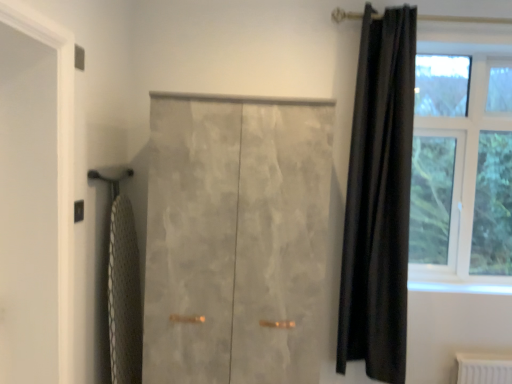
Question: Is clear glass window at upper right behind white mesh bath towel at left?

Choices:
 (A) yes
 (B) no

Answer: (A)

Question: Could you tell me if clear glass window at upper right is turned towards white mesh bath towel at left?

Choices:
 (A) no
 (B) yes

Answer: (A)

Question: Can you see clear glass window at upper right touching white mesh bath towel at left?

Choices:
 (A) no
 (B) yes

Answer: (A)

Question: Can you confirm if clear glass window at upper right is wider than white mesh bath towel at left?

Choices:
 (A) no
 (B) yes

Answer: (B)

Question: From the image's perspective, does clear glass window at upper right appear lower than white mesh bath towel at left?

Choices:
 (A) yes
 (B) no

Answer: (B)

Question: From their relative heights in the image, would you say white matte screen door at left is taller or shorter than white mesh bath towel at left?

Choices:
 (A) short
 (B) tall

Answer: (B)

Question: Based on their positions, is white matte screen door at left located to the left or right of white mesh bath towel at left?

Choices:
 (A) left
 (B) right

Answer: (A)

Question: Is point tap(13, 69) positioned closer to the camera than point tap(122, 238)?

Choices:
 (A) closer
 (B) farther

Answer: (A)

Question: Looking at the image, does white matte screen door at left seem bigger or smaller compared to white mesh bath towel at left?

Choices:
 (A) big
 (B) small

Answer: (A)

Question: Is satin gray wardrobe at center bigger or smaller than black velvet curtain at right?

Choices:
 (A) big
 (B) small

Answer: (A)

Question: Considering the positions of satin gray wardrobe at center and black velvet curtain at right in the image, is satin gray wardrobe at center taller or shorter than black velvet curtain at right?

Choices:
 (A) tall
 (B) short

Answer: (B)

Question: Considering the positions of point (159, 284) and point (377, 228), is point (159, 284) closer or farther from the camera than point (377, 228)?

Choices:
 (A) farther
 (B) closer

Answer: (B)

Question: From a real-world perspective, is satin gray wardrobe at center physically located above or below black velvet curtain at right?

Choices:
 (A) above
 (B) below

Answer: (B)

Question: Based on their positions, is clear glass window at upper right located to the left or right of black velvet curtain at right?

Choices:
 (A) left
 (B) right

Answer: (B)

Question: From a real-world perspective, is clear glass window at upper right above or below black velvet curtain at right?

Choices:
 (A) above
 (B) below

Answer: (A)